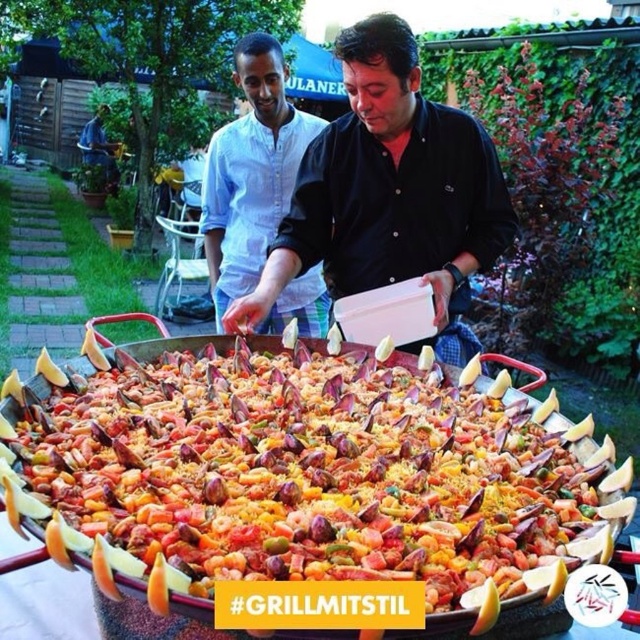
Question: Can you confirm if black matte shirt at center is positioned below light blue cotton shirt at center?

Choices:
 (A) yes
 (B) no

Answer: (A)

Question: Which of the following is the farthest from the observer?

Choices:
 (A) (236, 49)
 (B) (296, 356)

Answer: (A)

Question: Observing the image, what is the correct spatial positioning of multicolored rice at center in reference to black matte shirt at center?

Choices:
 (A) above
 (B) below

Answer: (B)

Question: Is multicolored rice at center below light blue cotton shirt at center?

Choices:
 (A) no
 (B) yes

Answer: (B)

Question: Which point appears farthest from the camera in this image?

Choices:
 (A) (435, 198)
 (B) (260, 148)
 (C) (289, 605)

Answer: (B)

Question: Which object is farther from the camera taking this photo?

Choices:
 (A) black matte shirt at center
 (B) multicolored rice at center

Answer: (A)